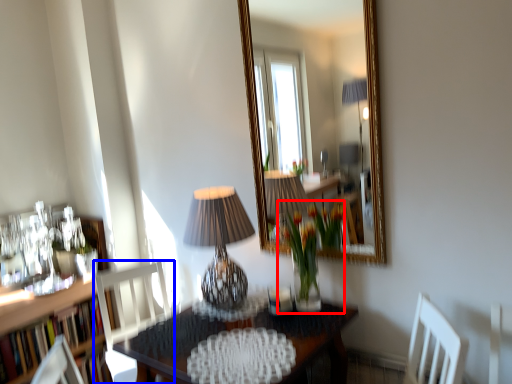
Question: Which of the following is the farthest to the observer, floral arrangement (highlighted by a red box) or chair (highlighted by a blue box)?

Choices:
 (A) floral arrangement
 (B) chair

Answer: (B)